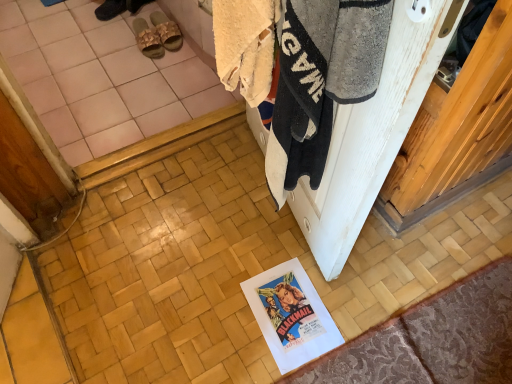
The height and width of the screenshot is (384, 512). In order to click on free region on the left part of patterned fabric doormat at lower right in this screenshot , I will do `click(244, 294)`.